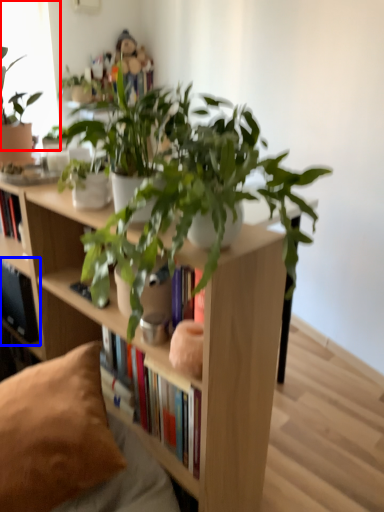
Question: Which object appears farthest to the camera in this image, window screen (highlighted by a red box) or shelf (highlighted by a blue box)?

Choices:
 (A) window screen
 (B) shelf

Answer: (B)